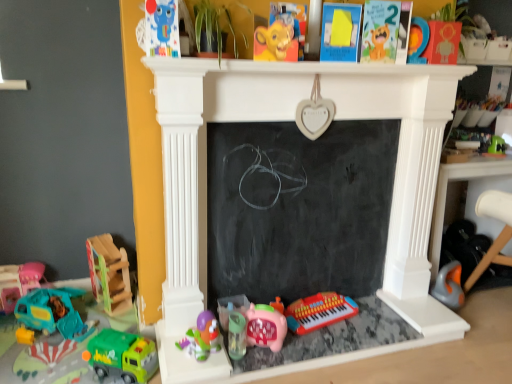
What are the coordinates of `free space to the right of teal plastic toy car at lower left, placed as the 11th toy when sorted from right to left` in the screenshot? It's located at (87, 331).